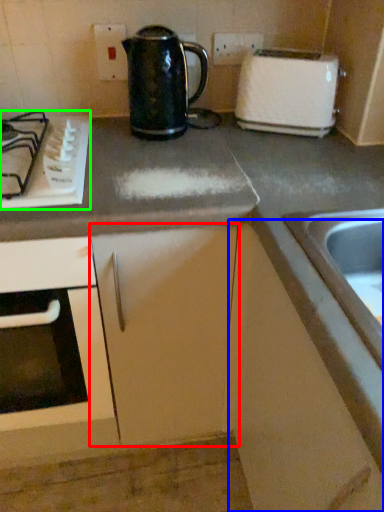
Question: Based on their relative distances, which object is farther from cabinetry (highlighted by a red box)? Choose from cabinetry (highlighted by a blue box) and gas stove (highlighted by a green box).

Choices:
 (A) cabinetry
 (B) gas stove

Answer: (B)